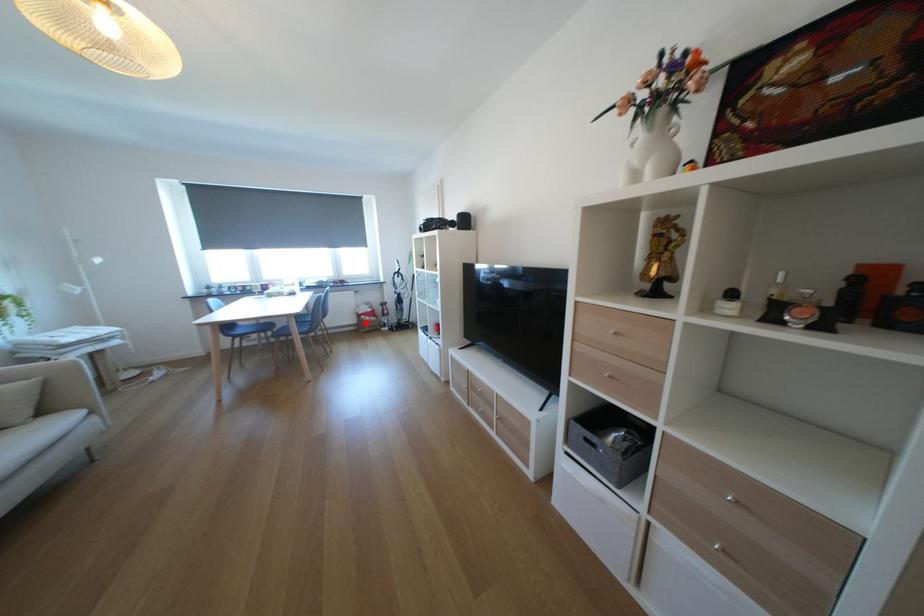
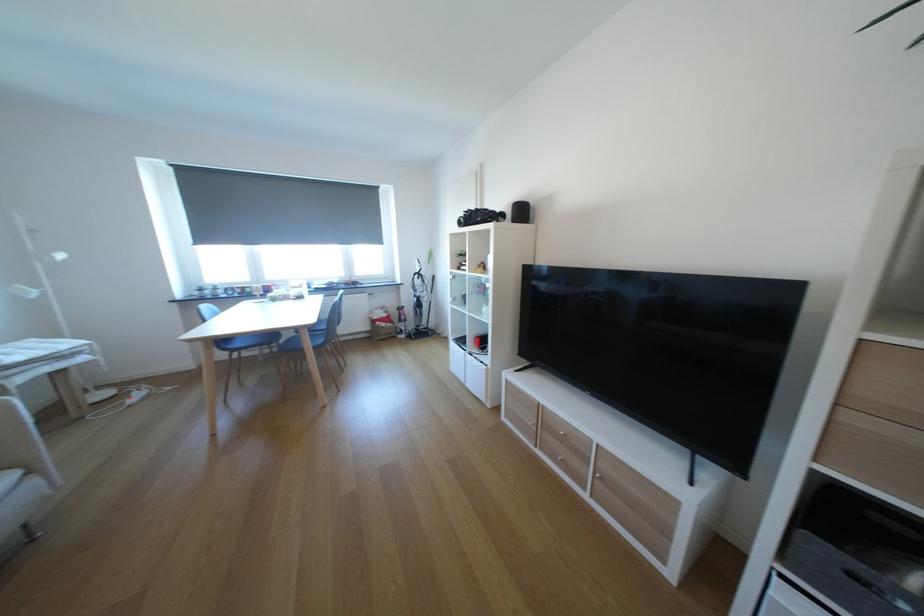
Where in the second image is the point corresponding to the highlighted location from the first image?

(379, 329)